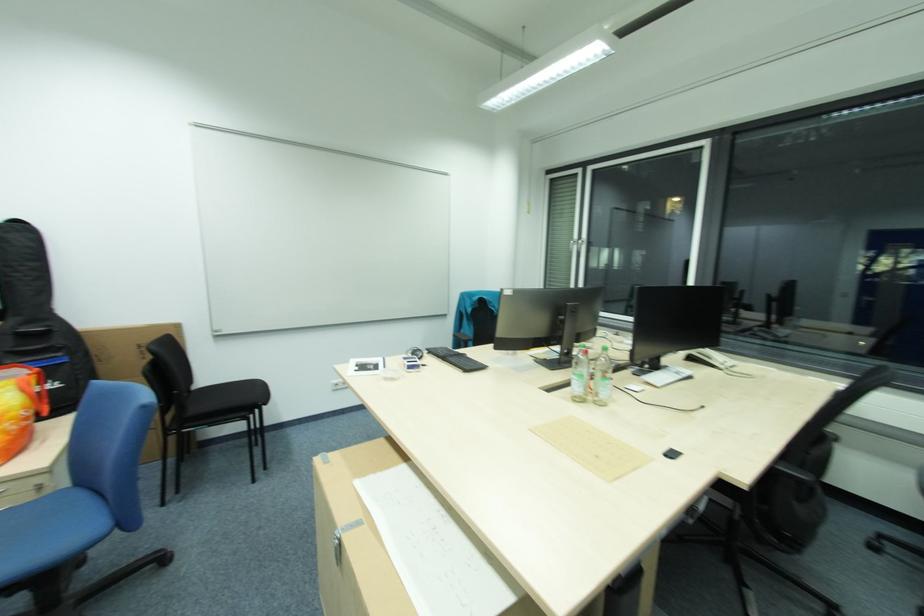
Find where to resting arm the black chair armrest. Please return your answer as a coordinate pair (x, y).

(787, 482)